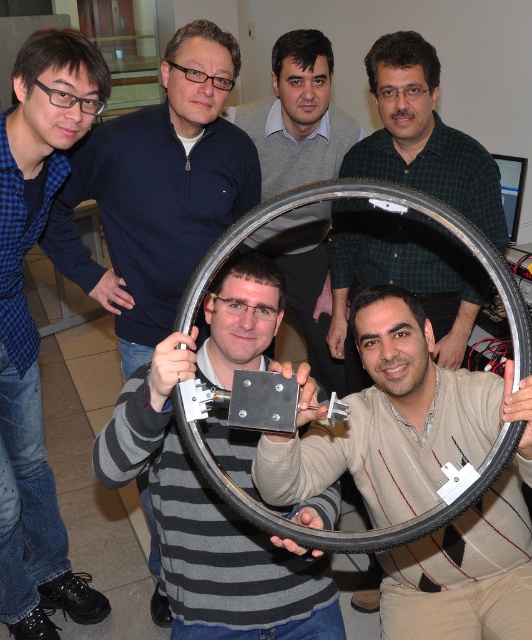
Question: Can you confirm if gray striped sweater at center is bigger than metallic gray rim at center?

Choices:
 (A) no
 (B) yes

Answer: (B)

Question: Which of the following is the farthest from the observer?

Choices:
 (A) (195, 141)
 (B) (317, 77)
 (C) (7, 570)
 (D) (342, 209)

Answer: (D)

Question: Which object is closer to the camera taking this photo?

Choices:
 (A) green checkered shirt at center
 (B) gray striped sweater at center
 (C) matte black jacket at upper left

Answer: (B)

Question: Is the position of blue checkered shirt at left more distant than that of metallic gray rim at center?

Choices:
 (A) no
 (B) yes

Answer: (B)

Question: Can you confirm if matte gray sweater at center is positioned above gray sweater at center?

Choices:
 (A) yes
 (B) no

Answer: (B)

Question: Which point is farther from the camera taking this photo?

Choices:
 (A) (412, 38)
 (B) (303, 445)

Answer: (A)